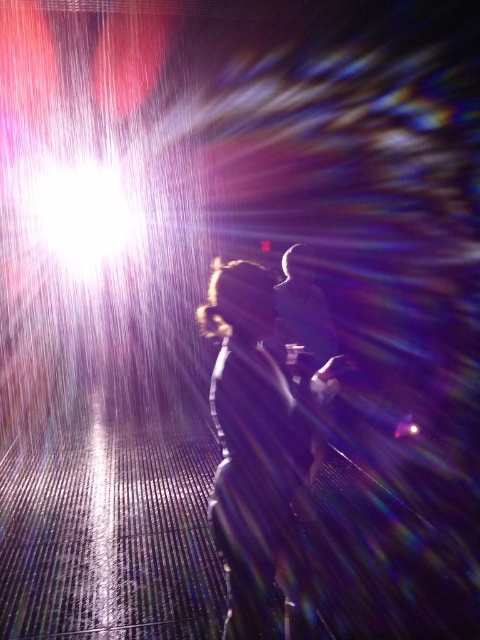
You are a photographer trying to capture a clear shot of the dark hair at center and the smooth black suit at center in this scene. Which object should you focus on first to ensure both are in sharp focus?

The dark hair at center is closer to the viewer than the smooth black suit at center. To ensure both are in sharp focus, you should focus on the dark hair at center first since it is closer, and the smooth black suit at center will fall within the depth of field if properly adjusted.

You are a photographer trying to capture the scene. You notice the dark hair at center and the smooth black suit at center. Which object is taller in the image?

The dark hair at center is taller than the smooth black suit at center according to the description.

You are standing in the room and see two points marked in the image. Which point is closer to you, point (229, 512) or point (302, 264)?

Point (229, 512) is closer to the viewer than point (302, 264).